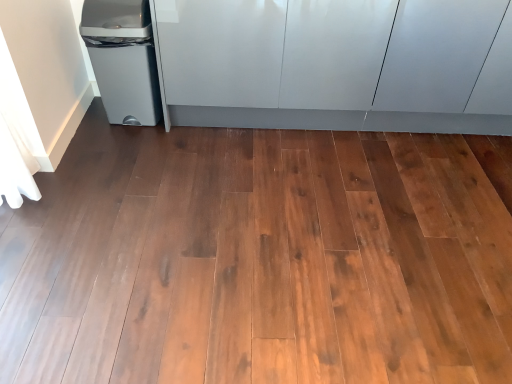
The width and height of the screenshot is (512, 384). I want to click on vacant space that's between glossy white cabinetry at upper center and white fabric curtain at left, so click(x=227, y=163).